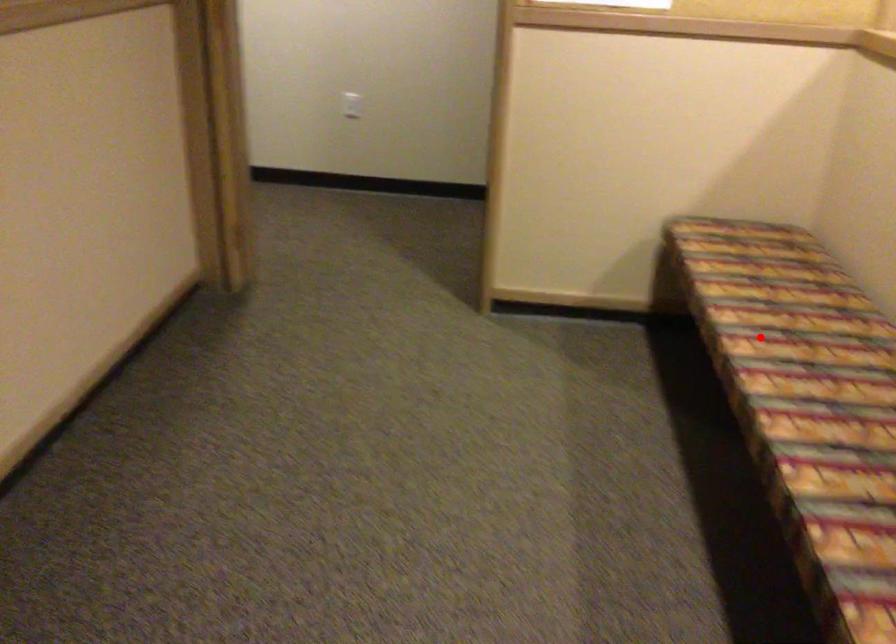
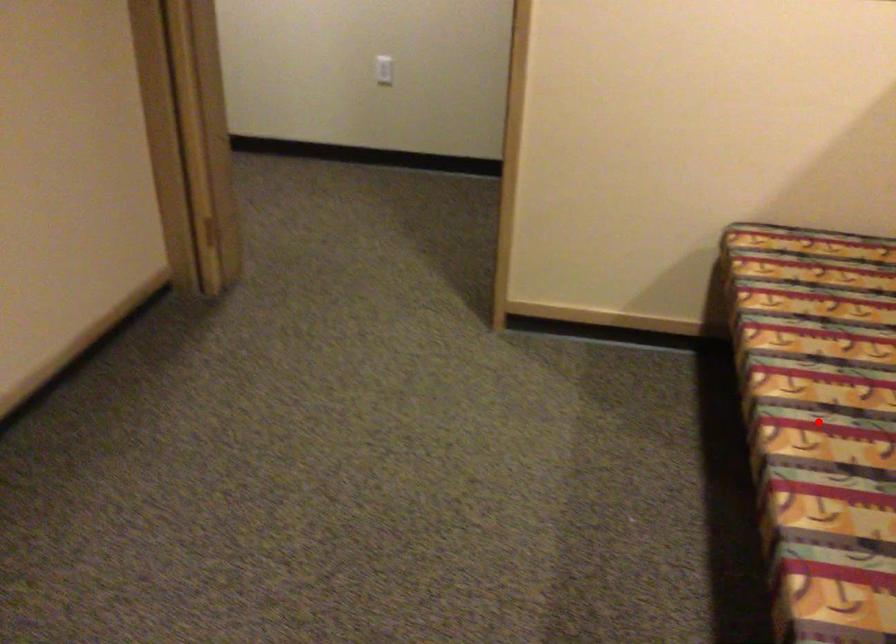
I am providing you with two images of the same scene from different viewpoints. A red point is marked on the first image and another point is marked on the second image. Are the points marked in image1 and image2 representing the same 3D position?

Yes